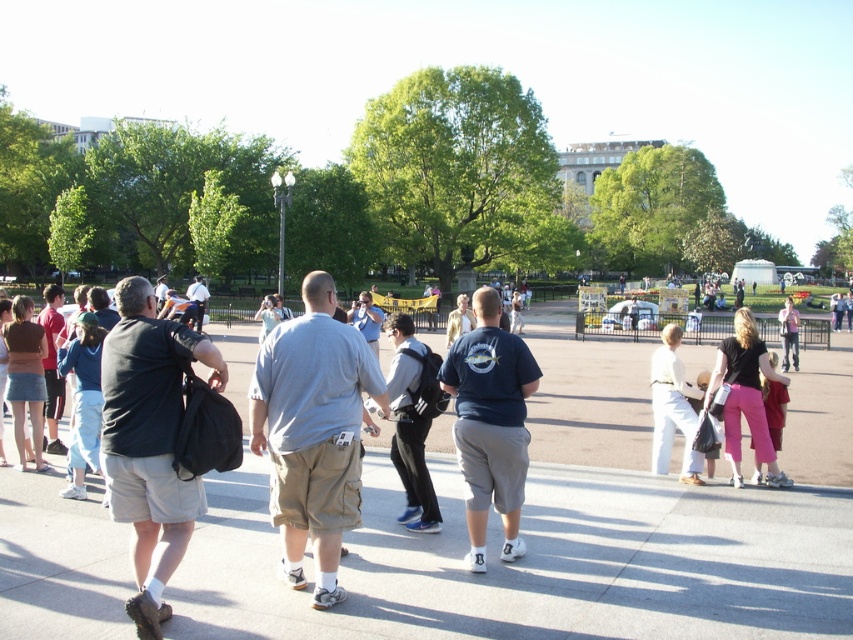
Question: Which of these objects is positioned farthest from the dark gray fabric backpack at left?

Choices:
 (A) dark blue t-shirt at center
 (B) dark gray shirt at center

Answer: (B)

Question: Where is gray concrete pavement at center located in relation to gray cotton shirt at center in the image?

Choices:
 (A) below
 (B) above

Answer: (A)

Question: Which point is closer to the camera?

Choices:
 (A) dark gray shirt at center
 (B) gray cotton shirt at center
 (C) dark blue t-shirt at center

Answer: (B)

Question: Can you confirm if dark gray fabric backpack at left is positioned to the right of dark blue t-shirt at center?

Choices:
 (A) no
 (B) yes

Answer: (A)

Question: Which point is closer to the camera taking this photo?

Choices:
 (A) (149, 435)
 (B) (647, 586)

Answer: (A)

Question: Does gray concrete pavement at center have a larger size compared to gray cotton shirt at center?

Choices:
 (A) yes
 (B) no

Answer: (A)